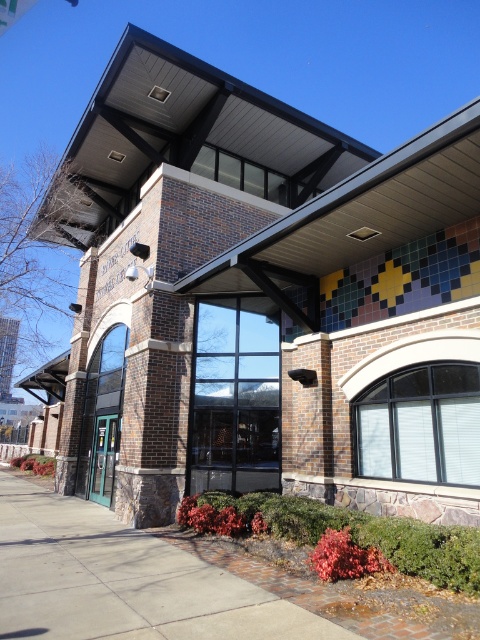
You are standing in front of the modern building and want to locate two specific points marked on the facade. The first point is at coordinate point(50, 577) and the second at point(92, 467). Based on the building structure, which point is closer to you?

Point(50, 577) is in front of point0.073, 0.192, so it is closer to you.

You are a delivery person with a cart that is 2 meters wide. You need to deliver a package to the matte glass door at center. Is there enough space on the gray concrete sidewalk at lower left to maneuver your cart?

The gray concrete sidewalk at lower left might be wider than matte glass door at center, so there is a possibility that the sidewalk is wide enough for the 2 meter wide cart. However, since the exact width isn t specified, it s uncertain. Proceed with caution and check the actual space before maneuvering.

You are a delivery person with a cart that is 3 feet wide. You need to move from the gray concrete sidewalk at lower left to the matte glass door at center. Is there enough space between them for your cart to pass through?

The distance between the gray concrete sidewalk at lower left and the matte glass door at center is 8.68 feet, which is more than enough space for a 3 feet wide cart to pass through.